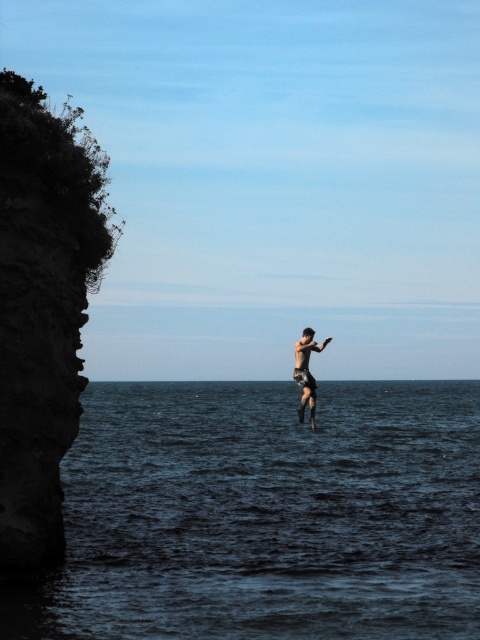
Question: Among these points, which one is farthest from the camera?

Choices:
 (A) tap(13, 358)
 (B) tap(210, 385)
 (C) tap(303, 387)

Answer: (B)

Question: Which of the following is the closest to the observer?

Choices:
 (A) (308, 353)
 (B) (56, 531)
 (C) (217, 534)

Answer: (B)

Question: Can you confirm if dark rock cliff at left is positioned to the left of skinny black shorts at center?

Choices:
 (A) no
 (B) yes

Answer: (B)

Question: Which point is closer to the camera?

Choices:
 (A) (286, 481)
 (B) (25, 406)

Answer: (B)

Question: Does dark blue water at center appear over skinny black shorts at center?

Choices:
 (A) yes
 (B) no

Answer: (B)

Question: Does dark rock cliff at left appear on the left side of skinny black shorts at center?

Choices:
 (A) no
 (B) yes

Answer: (B)